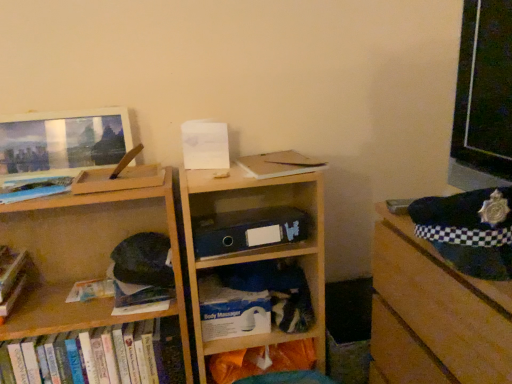
You are a GUI agent. You are given a task and a screenshot of the screen. Output one action in this format:
    pyautogui.click(x=<x>, y=<y>)
    Task: Click on the wooden bookshelf at center
    This screenshot has height=384, width=512.
    Given the screenshot: What is the action you would take?
    pyautogui.click(x=256, y=248)

What is the approximate height of wooden bookshelf at center?

wooden bookshelf at center is 37.22 inches in height.

At what (x,y) coordinates should I click in order to perform the action: click on matte blue book at left, arranged as the second book when ordered from the bottom. Please return your answer as a coordinate pair (x, y). Image resolution: width=512 pixels, height=384 pixels. Looking at the image, I should click on (34, 188).

In order to face white plastic body massager at lower center, marked as the 2th shelf in a left-to-right arrangement, should I rotate leftwards or rightwards?

To face it directly, rotate right by 0.877 degrees.

You are a GUI agent. You are given a task and a screenshot of the screen. Output one action in this format:
    pyautogui.click(x=<x>, y=<y>)
    Task: Click on the wooden bookshelf at center
    This screenshot has height=384, width=512.
    Given the screenshot: What is the action you would take?
    (256, 248)

I want to click on book to the right of matte wooden frame at upper left, so click(98, 356).

Considering the sizes of objects hardcover books at lower left, the 1th book positioned from the bottom, and matte wooden frame at upper left in the image provided, who is taller, hardcover books at lower left, the 1th book positioned from the bottom, or matte wooden frame at upper left?

hardcover books at lower left, the 1th book positioned from the bottom, is taller.

Between hardcover books at lower left, the 1th book positioned from the bottom, and matte wooden frame at upper left, which one has larger width?

Wider between the two is hardcover books at lower left, the 1th book positioned from the bottom.

Is hardcover books at lower left, the 1th book positioned from the bottom, looking in the opposite direction of matte wooden frame at upper left?

No, matte wooden frame at upper left is not at the back of hardcover books at lower left, the 1th book positioned from the bottom.

From a real-world perspective, between matte blue book at left, which appears as the 1th book when viewed from the top, and matte wooden frame at upper left, who is vertically lower?

matte blue book at left, which appears as the 1th book when viewed from the top, is physically lower.

Where is `computer monitor lying on the right of matte blue book at left, which appears as the 1th book when viewed from the top`? computer monitor lying on the right of matte blue book at left, which appears as the 1th book when viewed from the top is located at coordinates (63, 140).

Considering the relative positions of matte blue book at left, which appears as the 1th book when viewed from the top, and matte wooden frame at upper left in the image provided, is matte blue book at left, which appears as the 1th book when viewed from the top, to the left or to the right of matte wooden frame at upper left?

matte blue book at left, which appears as the 1th book when viewed from the top, is to the left of matte wooden frame at upper left.

Consider the image. Is matte blue book at left, arranged as the second book when ordered from the bottom, not inside matte wooden frame at upper left?

matte blue book at left, arranged as the second book when ordered from the bottom, lies outside matte wooden frame at upper left's area.

Measure the distance from hardcover books at lower left, arranged as the 2th book when viewed from the top, to black checkered fabric at right.

A distance of 30.62 inches exists between hardcover books at lower left, arranged as the 2th book when viewed from the top, and black checkered fabric at right.

Which object is positioned more to the right, hardcover books at lower left, arranged as the 2th book when viewed from the top, or black checkered fabric at right?

Positioned to the right is black checkered fabric at right.

From a real-world perspective, is hardcover books at lower left, the 1th book positioned from the bottom, beneath black checkered fabric at right?

Yes.

Does wooden bookshelf at center have a greater height compared to black checkered fabric at right?

Indeed, wooden bookshelf at center has a greater height compared to black checkered fabric at right.

Locate an element on the screen. The height and width of the screenshot is (384, 512). bookshelf below the black checkered fabric at right (from a real-world perspective) is located at coordinates (256, 248).

Considering the points (324, 299) and (456, 354), which point is behind, point (324, 299) or point (456, 354)?

The point (324, 299) is behind.

Relative to white plastic body massager at lower center, marked as the 2th shelf in a left-to-right arrangement, is wooden bookshelf at left, marked as the 1th shelf in a left-to-right arrangement, in front or behind?

In the image, wooden bookshelf at left, marked as the 1th shelf in a left-to-right arrangement, appears in front of white plastic body massager at lower center, marked as the 2th shelf in a left-to-right arrangement.

In the scene shown: Considering the sizes of wooden bookshelf at left, the 2th shelf when ordered from right to left, and white plastic body massager at lower center, marked as the 2th shelf in a left-to-right arrangement, in the image, is wooden bookshelf at left, the 2th shelf when ordered from right to left, bigger or smaller than white plastic body massager at lower center, marked as the 2th shelf in a left-to-right arrangement,?

Clearly, wooden bookshelf at left, the 2th shelf when ordered from right to left, is larger in size than white plastic body massager at lower center, marked as the 2th shelf in a left-to-right arrangement.

In the image, is wooden bookshelf at left, marked as the 1th shelf in a left-to-right arrangement, on the left side or the right side of white plastic body massager at lower center, which is counted as the first shelf, starting from the right?

From the image, it's evident that wooden bookshelf at left, marked as the 1th shelf in a left-to-right arrangement, is to the left of white plastic body massager at lower center, which is counted as the first shelf, starting from the right.

Looking at this image, is wooden bookshelf at center positioned far away from white matte paperback book at center?

wooden bookshelf at center is actually quite close to white matte paperback book at center.

Locate an element on the screen. This screenshot has height=384, width=512. bookshelf located above the white matte paperback book at center (from a real-world perspective) is located at coordinates (256, 248).

Can you tell me how much wooden bookshelf at center and white matte paperback book at center differ in facing direction?

3.27e-05 degrees separate the facing orientations of wooden bookshelf at center and white matte paperback book at center.

Considering the relative positions of wooden bookshelf at center and white matte paperback book at center in the image provided, is wooden bookshelf at center to the right of white matte paperback book at center from the viewer's perspective?

Correct, you'll find wooden bookshelf at center to the right of white matte paperback book at center.

Can you confirm if black checkered fabric at right is smaller than white plastic body massager at lower center, marked as the 2th shelf in a left-to-right arrangement?

Incorrect, black checkered fabric at right is not smaller in size than white plastic body massager at lower center, marked as the 2th shelf in a left-to-right arrangement.

From a real-world perspective, is black checkered fabric at right positioned over white plastic body massager at lower center, which is counted as the first shelf, starting from the right, based on gravity?

Correct, in the physical world, black checkered fabric at right is higher than white plastic body massager at lower center, which is counted as the first shelf, starting from the right.

How different are the orientations of black checkered fabric at right and white plastic body massager at lower center, which is counted as the first shelf, starting from the right, in degrees?

The angle between the facing direction of black checkered fabric at right and the facing direction of white plastic body massager at lower center, which is counted as the first shelf, starting from the right, is 91.3 degrees.

Is black checkered fabric at right beside white plastic body massager at lower center, marked as the 2th shelf in a left-to-right arrangement?

black checkered fabric at right and white plastic body massager at lower center, marked as the 2th shelf in a left-to-right arrangement, are not in contact.

The height and width of the screenshot is (384, 512). I want to click on book on the right side of matte wooden frame at upper left, so click(x=98, y=356).

Locate an element on the screen. This screenshot has width=512, height=384. book on the left of the matte wooden frame at upper left is located at coordinates (34, 188).

Considering their positions, is wooden bookshelf at center positioned further to hardcover books at lower left, the 1th book positioned from the bottom, than matte blue book at left, which appears as the 1th book when viewed from the top?

The object further to hardcover books at lower left, the 1th book positioned from the bottom, is matte blue book at left, which appears as the 1th book when viewed from the top.

When comparing their distances from black checkered fabric at right, does wooden bookshelf at center or matte blue book at left, which appears as the 1th book when viewed from the top, seem further?

matte blue book at left, which appears as the 1th book when viewed from the top, lies further to black checkered fabric at right than the other object.

When comparing their distances from wooden bookshelf at left, marked as the 1th shelf in a left-to-right arrangement, does wooden bookshelf at center or matte blue book at left, which appears as the 1th book when viewed from the top, seem further?

wooden bookshelf at center is positioned further to the anchor wooden bookshelf at left, marked as the 1th shelf in a left-to-right arrangement.

Based on their spatial positions, is black checkered fabric at right or hardcover books at lower left, the 1th book positioned from the bottom, closer to white plastic body massager at lower center, which is counted as the first shelf, starting from the right?

The object closer to white plastic body massager at lower center, which is counted as the first shelf, starting from the right, is hardcover books at lower left, the 1th book positioned from the bottom.

When comparing their distances from matte blue book at left, which appears as the 1th book when viewed from the top, does black checkered fabric at right or white plastic body massager at lower center, which is counted as the first shelf, starting from the right, seem closer?

The object closer to matte blue book at left, which appears as the 1th book when viewed from the top, is white plastic body massager at lower center, which is counted as the first shelf, starting from the right.

Considering their positions, is black checkered fabric at right positioned closer to wooden bookshelf at center than wooden bookshelf at left, marked as the 1th shelf in a left-to-right arrangement?

The object closer to wooden bookshelf at center is wooden bookshelf at left, marked as the 1th shelf in a left-to-right arrangement.

Which object lies further to the anchor point wooden bookshelf at center, wooden bookshelf at left, marked as the 1th shelf in a left-to-right arrangement, or white plastic body massager at lower center, marked as the 2th shelf in a left-to-right arrangement?

The object further to wooden bookshelf at center is wooden bookshelf at left, marked as the 1th shelf in a left-to-right arrangement.

Based on their spatial positions, is black checkered fabric at right or matte wooden frame at upper left closer to wooden bookshelf at center?

black checkered fabric at right lies closer to wooden bookshelf at center than the other object.

This screenshot has height=384, width=512. What are the coordinates of `paperback book that lies between matte wooden frame at upper left and white plastic body massager at lower center, marked as the 2th shelf in a left-to-right arrangement, from top to bottom` in the screenshot? It's located at (231, 310).

This screenshot has height=384, width=512. Identify the location of paperback book between matte wooden frame at upper left and black checkered fabric at right. (231, 310).

Identify the location of paperback book between hardcover books at lower left, arranged as the 2th book when viewed from the top, and wooden bookshelf at center from left to right. (231, 310).

Find the location of a particular element. The height and width of the screenshot is (384, 512). computer monitor between matte blue book at left, which appears as the 1th book when viewed from the top, and wooden bookshelf at center is located at coordinates (63, 140).